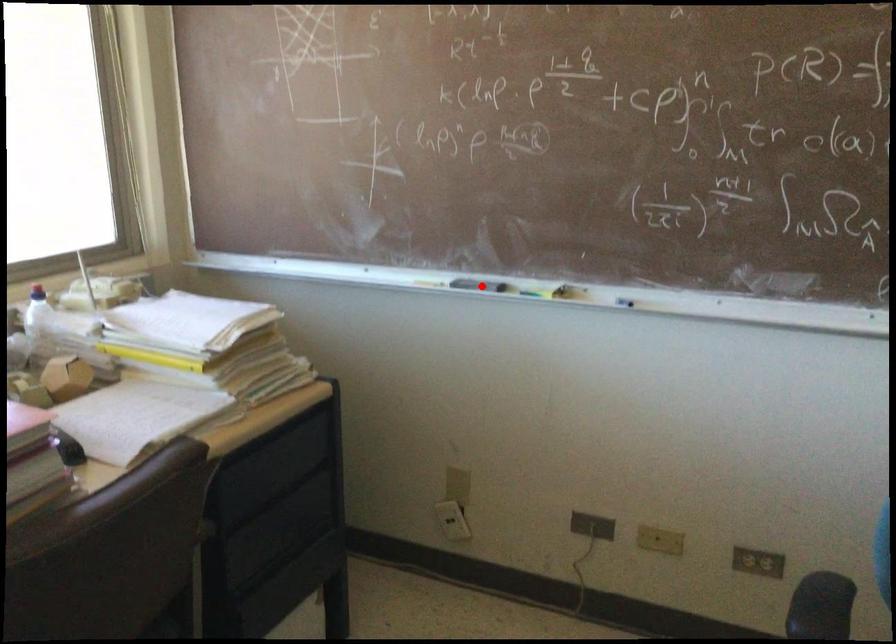
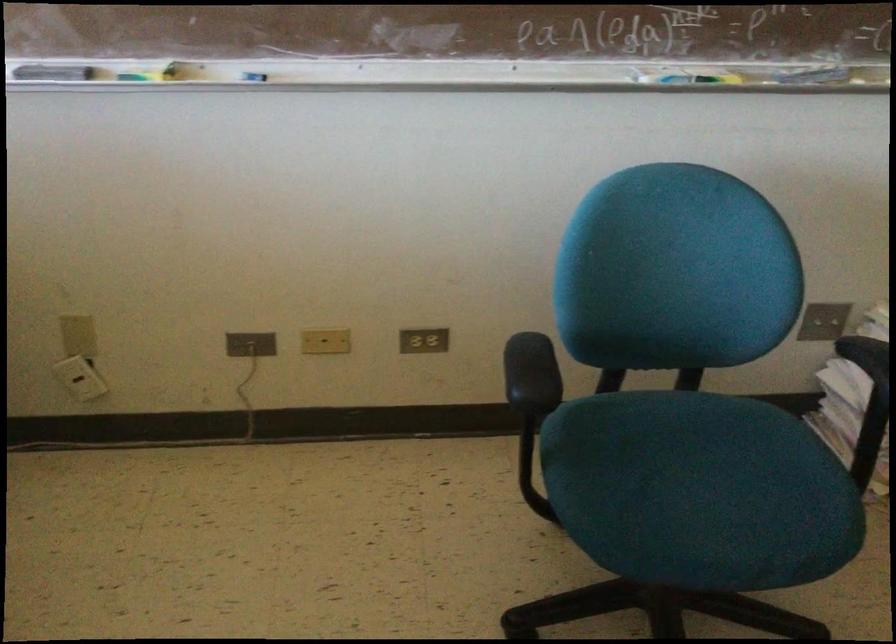
Locate, in the second image, the point that corresponds to the highlighted location in the first image.

(53, 73)